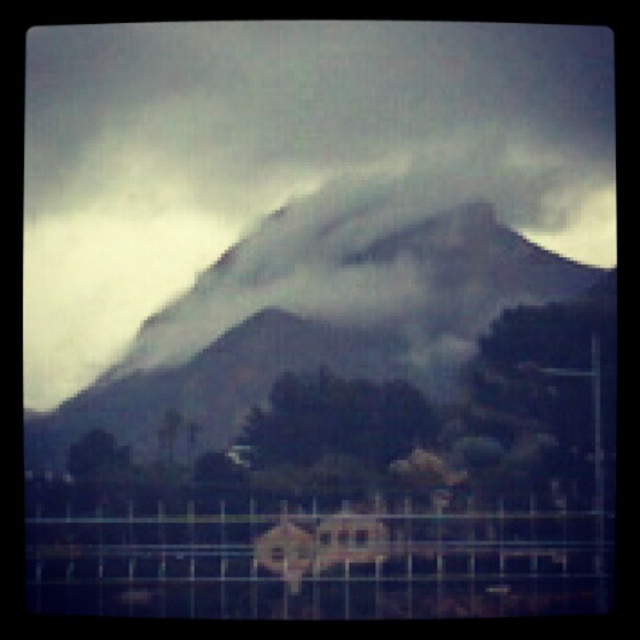
You are a hiker who wants to take a photo of the foggy gray mountain at center and the metallic wire fence at lower center. Which object should you focus on first if you want both to be in sharp focus?

The metallic wire fence at lower center should be focused on first because it is closer to the camera than the foggy gray mountain at center, which is further away. By focusing on the closer object, the mountain will also be in focus due to the depth of field.

You are standing at the origin point in the image and want to locate the foggy gray mountain at center. What are its coordinates?

The foggy gray mountain at center is located at coordinates point (317, 312).